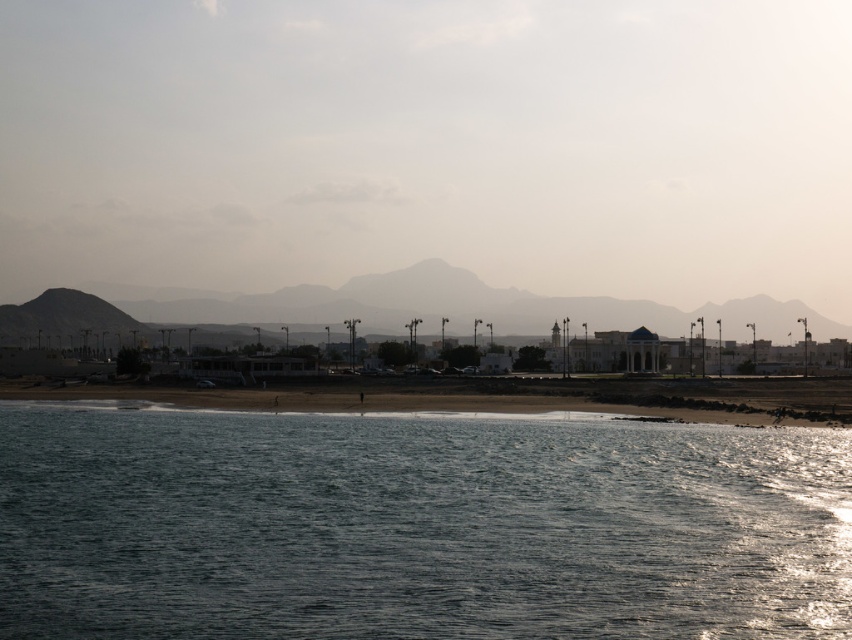
Who is positioned more to the right, shiny blue water at center or sandy beach at lower center?

Positioned to the right is shiny blue water at center.

Is shiny blue water at center above sandy beach at lower center?

Incorrect, shiny blue water at center is not positioned above sandy beach at lower center.

In order to click on shiny blue water at center in this screenshot , I will do `click(416, 525)`.

Describe the element at coordinates (453, 307) in the screenshot. Image resolution: width=852 pixels, height=640 pixels. I see `sandy brown mountain at center` at that location.

Can you confirm if sandy brown mountain at center is bigger than sandy beach at lower center?

Correct, sandy brown mountain at center is larger in size than sandy beach at lower center.

Which is behind, point (517, 317) or point (843, 378)?

Point (517, 317)

This screenshot has height=640, width=852. In order to click on sandy brown mountain at center in this screenshot , I will do `click(453, 307)`.

Measure the distance between point (x=459, y=474) and camera.

Point (x=459, y=474) is 46.52 meters away from camera.

Image resolution: width=852 pixels, height=640 pixels. Find the location of `shiny blue water at center`. shiny blue water at center is located at coordinates (416, 525).